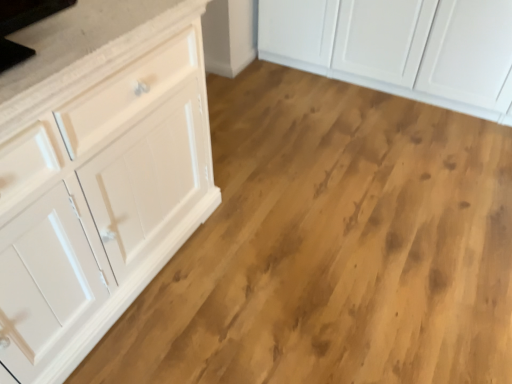
What do you see at coordinates (332, 247) in the screenshot? I see `natural wood floor at center` at bounding box center [332, 247].

Where is `natural wood floor at center`? The image size is (512, 384). natural wood floor at center is located at coordinates (332, 247).

This screenshot has height=384, width=512. Identify the location of natural wood floor at center. (332, 247).